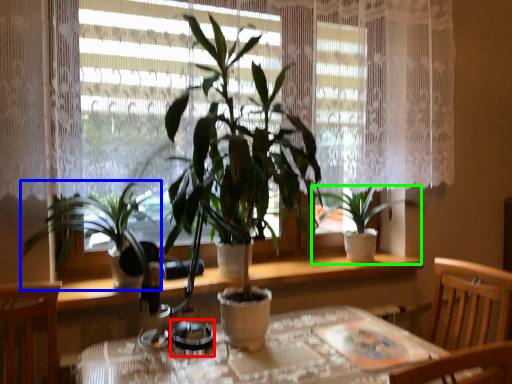
Question: Considering the real-world distances, which object is closest to tableware (highlighted by a red box)? houseplant (highlighted by a blue box) or houseplant (highlighted by a green box).

Choices:
 (A) houseplant
 (B) houseplant

Answer: (A)